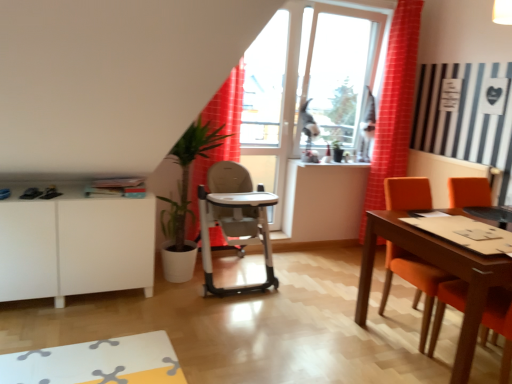
The image size is (512, 384). I want to click on free spot in front of silver metallic highchair at center, so click(x=229, y=326).